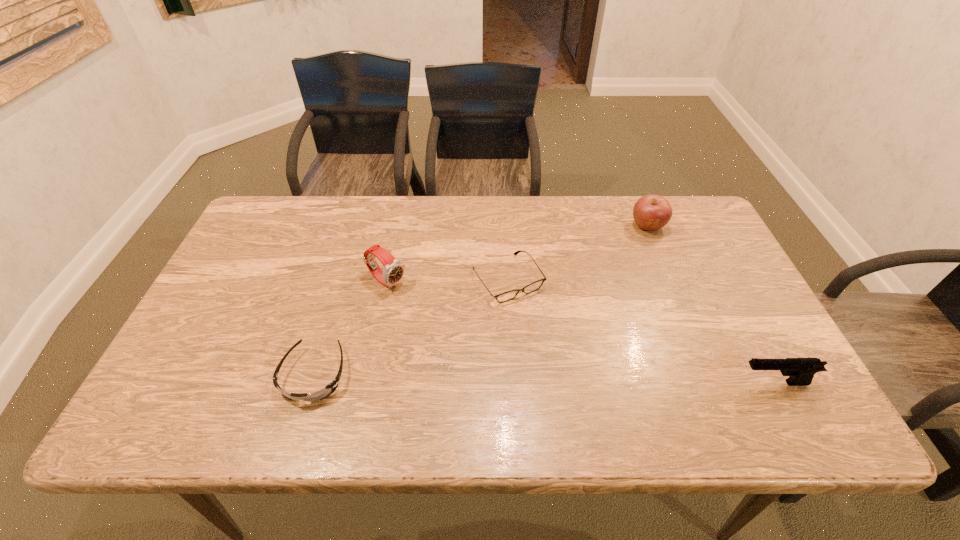
Locate an element on the screen. sunglasses is located at coordinates (329, 389).

Locate an element on the screen. pistol is located at coordinates (801, 371).

Identify the location of the third object from left to right. (509, 295).

You are a GUI agent. You are given a task and a screenshot of the screen. Output one action in this format:
    pyautogui.click(x=<x>, y=<y>)
    Task: Click on the apple
    The height and width of the screenshot is (540, 960).
    Given the screenshot: What is the action you would take?
    pyautogui.click(x=651, y=212)

Where is `the tallest object`? The width and height of the screenshot is (960, 540). the tallest object is located at coordinates (393, 272).

Locate an element on the screen. The width and height of the screenshot is (960, 540). free space located on the front-facing side of the pistol is located at coordinates (661, 383).

Locate an element on the screen. blank area located 0.280m on the front-facing side of the pistol is located at coordinates (612, 383).

Where is `vacant area located on the front-facing side of the pistol`? This screenshot has width=960, height=540. vacant area located on the front-facing side of the pistol is located at coordinates pos(599,383).

Find the location of `vacant space located on the front-facing side of the third object from left to right`. vacant space located on the front-facing side of the third object from left to right is located at coordinates (536, 317).

The width and height of the screenshot is (960, 540). I want to click on free space located on the front-facing side of the third object from left to right, so click(x=540, y=323).